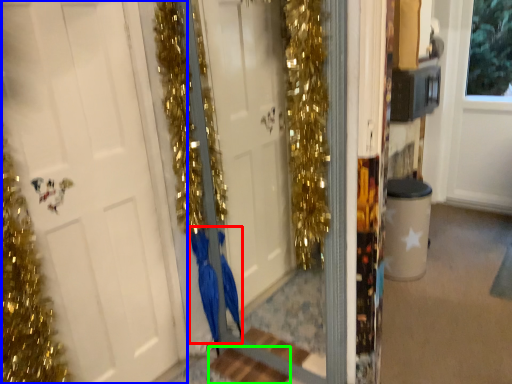
Question: Based on their relative distances, which object is nearer to dress (highlighted by a red box)? Choose from door (highlighted by a blue box) and stair (highlighted by a green box).

Choices:
 (A) door
 (B) stair

Answer: (B)